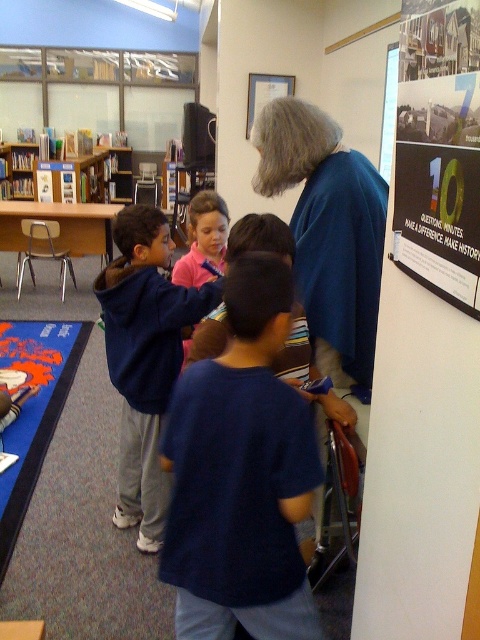
You are a visitor in the library and want to hang a new poster that is the same size as the green paper poster at upper right. Which object can you use as a reference for the maximum width needed to ensure it fits without exceeding the space taken by the wooden bookshelf at upper left?

The green paper poster at upper right has a lesser width compared to the wooden bookshelf at upper left, so you can use the width of the wooden bookshelf at upper left as a reference. Since the poster is narrower, the new poster will fit within the space of the wooden bookshelf at upper left.